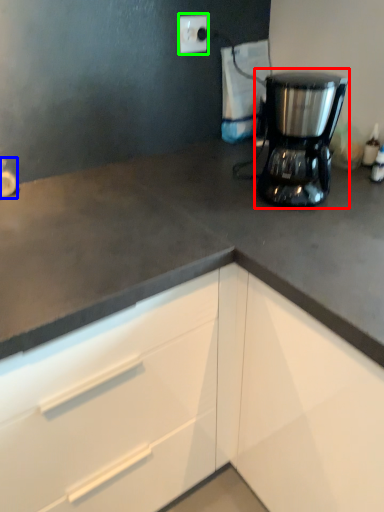
Question: Which object is positioned closest to home appliance (highlighted by a red box)? Select from faucet (highlighted by a blue box) and electric outlet (highlighted by a green box).

Choices:
 (A) faucet
 (B) electric outlet

Answer: (B)